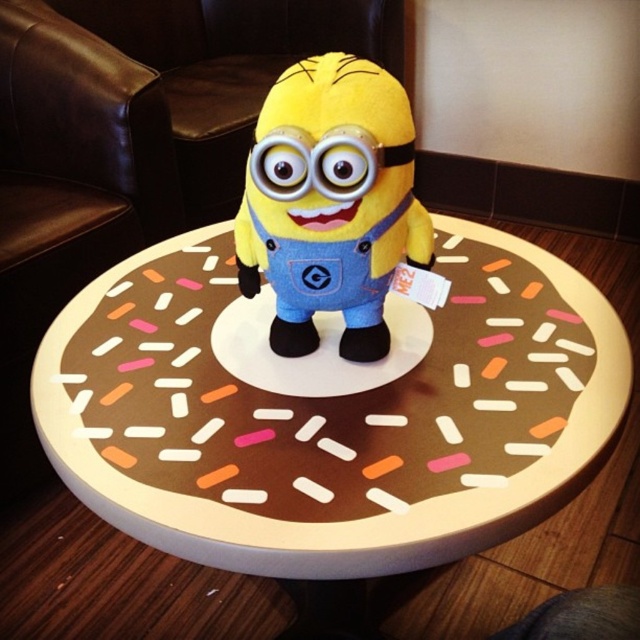
Question: From the image, what is the correct spatial relationship of brownsprinkleddonut at center in relation to yellow plush toy at center?

Choices:
 (A) right
 (B) left

Answer: (B)

Question: Which point is closer to the camera?

Choices:
 (A) (173, 417)
 (B) (301, 77)

Answer: (B)

Question: Is brownsprinkleddonut at center bigger than yellow plush toy at center?

Choices:
 (A) yes
 (B) no

Answer: (A)

Question: Which point appears closest to the camera in this image?

Choices:
 (A) tap(525, 262)
 (B) tap(410, 140)

Answer: (B)

Question: Does brownsprinkleddonut at center appear on the right side of yellow plush toy at center?

Choices:
 (A) no
 (B) yes

Answer: (A)